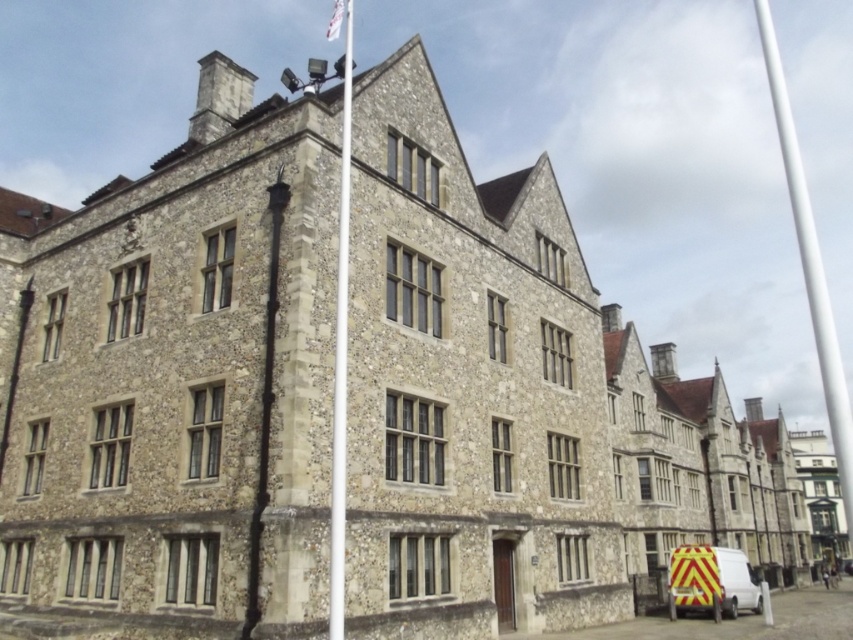
You are standing in front of the historic stone building and see the white smooth flag pole at upper center and the white fabric flag at upper center. Which object is closer to you?

The white smooth flag pole at upper center is closer to you because it is in front of the white fabric flag at upper center.